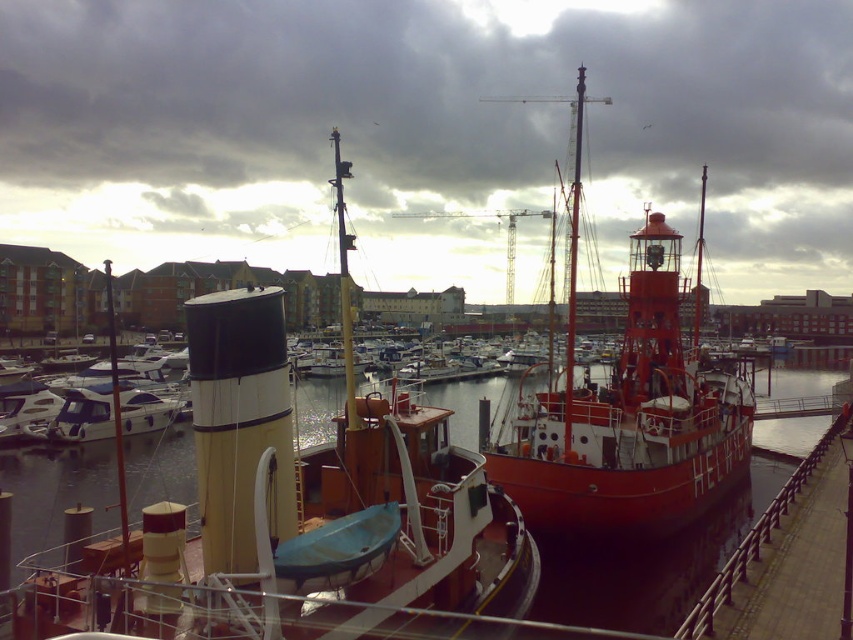
Question: Among these points, which one is nearest to the camera?

Choices:
 (A) (785, 420)
 (B) (645, 493)

Answer: (B)

Question: Considering the real-world distances, which object is closest to the matte yellow and black smokestack at center?

Choices:
 (A) glossy water at center
 (B) shiny red boat at center

Answer: (B)

Question: Does matte yellow and black smokestack at center appear on the left side of glossy water at center?

Choices:
 (A) yes
 (B) no

Answer: (A)

Question: Does matte yellow and black smokestack at center have a greater width compared to shiny red boat at center?

Choices:
 (A) yes
 (B) no

Answer: (A)

Question: Observing the image, what is the correct spatial positioning of matte yellow and black smokestack at center in reference to shiny red boat at center?

Choices:
 (A) below
 (B) above

Answer: (A)

Question: Estimate the real-world distances between objects in this image. Which object is closer to the matte yellow and black smokestack at center?

Choices:
 (A) shiny red boat at center
 (B) glossy water at center

Answer: (A)